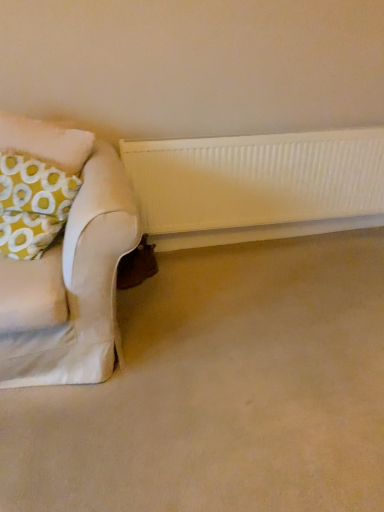
Identify the location of free space below white ribbed radiator at center (from a real-world perspective). The width and height of the screenshot is (384, 512). (279, 238).